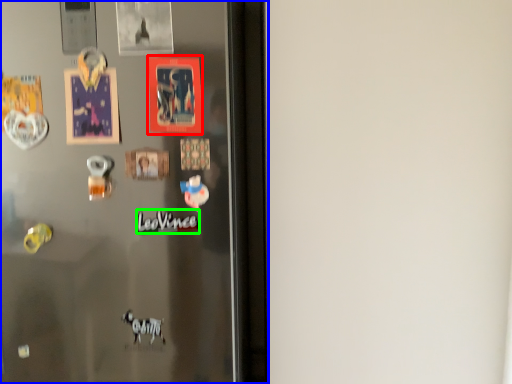
Question: Considering the real-world distances, which object is closest to postcard (highlighted by a red box)? refrigerator (highlighted by a blue box) or writing (highlighted by a green box).

Choices:
 (A) refrigerator
 (B) writing

Answer: (B)